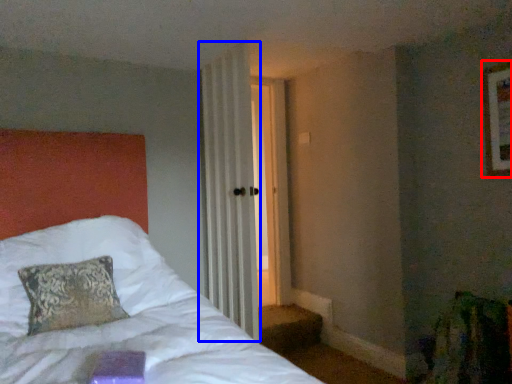
Question: Which of the following is the farthest to the observer, picture frame (highlighted by a red box) or curtain (highlighted by a blue box)?

Choices:
 (A) picture frame
 (B) curtain

Answer: (B)